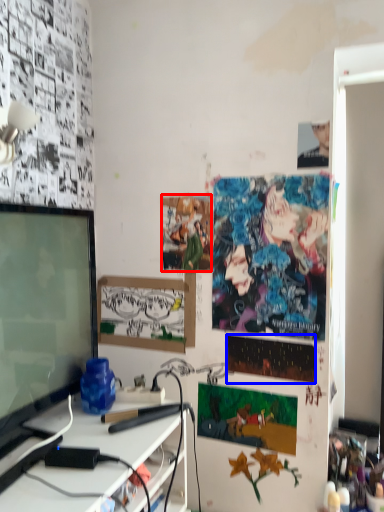
Question: Which object appears farthest to the camera in this image, poster page (highlighted by a red box) or poster page (highlighted by a blue box)?

Choices:
 (A) poster page
 (B) poster page

Answer: (A)